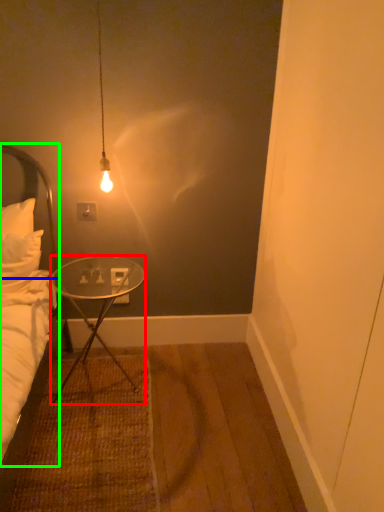
Question: Which is farther away from desk (highlighted by a red box)? headboard (highlighted by a blue box) or bed (highlighted by a green box)?

Choices:
 (A) headboard
 (B) bed

Answer: (A)